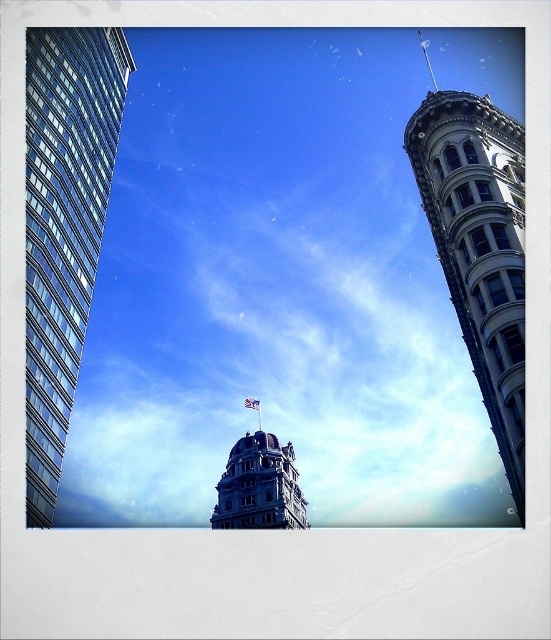
Question: Is white stone tower at upper right further to the viewer compared to blue stone tower at center?

Choices:
 (A) no
 (B) yes

Answer: (A)

Question: Which point is closer to the camera?

Choices:
 (A) blue stone tower at center
 (B) white fabric flag at center
 (C) white stone tower at upper right

Answer: (C)

Question: In this image, where is white fluffy cloud at center located relative to blue stone tower at center?

Choices:
 (A) right
 (B) left

Answer: (B)

Question: Is glassy reflective skyscraper at left smaller than white fabric flag at center?

Choices:
 (A) yes
 (B) no

Answer: (B)

Question: Which point is closer to the camera?

Choices:
 (A) (276, 508)
 (B) (72, 77)
 (C) (494, 240)

Answer: (C)

Question: Which point appears closest to the camera in this image?

Choices:
 (A) (237, 484)
 (B) (245, 403)

Answer: (A)